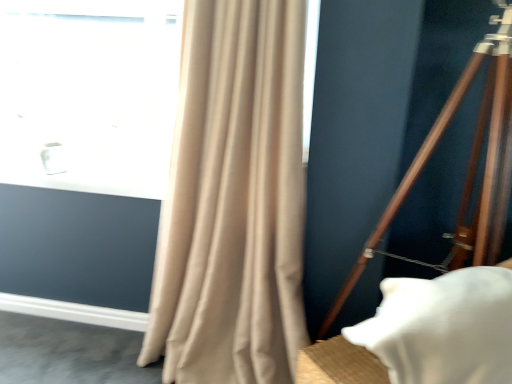
Identify the location of white matte pillow at lower right. This screenshot has height=384, width=512. (443, 327).

Locate an element on the screen. This screenshot has height=384, width=512. beige fabric curtain at left is located at coordinates (233, 200).

Can you confirm if white matte pillow at lower right is thinner than transparent glass window at upper left?

Incorrect, the width of white matte pillow at lower right is not less than that of transparent glass window at upper left.

Locate an element on the screen. This screenshot has width=512, height=384. pillow on the right of transparent glass window at upper left is located at coordinates (443, 327).

Is white matte pillow at lower right oriented away from transparent glass window at upper left?

Yes, white matte pillow at lower right is facing away from transparent glass window at upper left.

Is transparent glass window at upper left inside white matte pillow at lower right?

No, white matte pillow at lower right does not contain transparent glass window at upper left.

Does wooden tripod at right have a larger size compared to transparent glass window at upper left?

Indeed, wooden tripod at right has a larger size compared to transparent glass window at upper left.

Identify the location of tripod below the transparent glass window at upper left (from a real-world perspective). The image size is (512, 384). (467, 168).

Is wooden tripod at right directly adjacent to transparent glass window at upper left?

No.

Is wooden tripod at right at the left side of beige fabric curtain at left?

Incorrect, wooden tripod at right is not on the left side of beige fabric curtain at left.

Who is taller, wooden tripod at right or beige fabric curtain at left?

wooden tripod at right is taller.

Which of these two, wooden tripod at right or beige fabric curtain at left, is wider?

With larger width is wooden tripod at right.

From the picture: From the image's perspective, is beige fabric curtain at left located above wooden tripod at right?

Correct, beige fabric curtain at left appears higher than wooden tripod at right in the image.

Which object is positioned more to the left, beige fabric curtain at left or wooden tripod at right?

beige fabric curtain at left is more to the left.

Find the location of `tripod in front of the beige fabric curtain at left`. tripod in front of the beige fabric curtain at left is located at coordinates (467, 168).

How many degrees apart are the facing directions of beige fabric curtain at left and wooden tripod at right?

The angle between the facing direction of beige fabric curtain at left and the facing direction of wooden tripod at right is 41.7 degrees.

Is beige fabric curtain at left next to transparent glass window at upper left?

No, beige fabric curtain at left is not in contact with transparent glass window at upper left.

Can you tell me how much beige fabric curtain at left and transparent glass window at upper left differ in facing direction?

1.35 degrees.

Who is taller, beige fabric curtain at left or transparent glass window at upper left?

Standing taller between the two is beige fabric curtain at left.

Which object is further away from the camera taking this photo, beige fabric curtain at left or transparent glass window at upper left?

Positioned behind is transparent glass window at upper left.

Find the location of `curtain above the white matte pillow at lower right (from the image's perspective)`. curtain above the white matte pillow at lower right (from the image's perspective) is located at coordinates (233, 200).

Is white matte pillow at lower right oriented away from beige fabric curtain at left?

That's right, white matte pillow at lower right is facing away from beige fabric curtain at left.

Would you say white matte pillow at lower right is outside beige fabric curtain at left?

white matte pillow at lower right lies outside beige fabric curtain at left's area.

From the image's perspective, which is above, white matte pillow at lower right or beige fabric curtain at left?

beige fabric curtain at left.

How different are the orientations of beige fabric curtain at left and white matte pillow at lower right in degrees?

The angle between the facing direction of beige fabric curtain at left and the facing direction of white matte pillow at lower right is 37 degrees.

Is beige fabric curtain at left positioned beyond the bounds of white matte pillow at lower right?

beige fabric curtain at left is positioned outside white matte pillow at lower right.

Is beige fabric curtain at left wider than white matte pillow at lower right?

No, beige fabric curtain at left is not wider than white matte pillow at lower right.

From a real-world perspective, is beige fabric curtain at left under white matte pillow at lower right?

No, from a real-world perspective, beige fabric curtain at left is not below white matte pillow at lower right.

You are a GUI agent. You are given a task and a screenshot of the screen. Output one action in this format:
    pyautogui.click(x=<x>, y=<y>)
    Task: Click on the pillow located underneath the transparent glass window at upper left (from a real-world perspective)
    
    Given the screenshot: What is the action you would take?
    pyautogui.click(x=443, y=327)

The height and width of the screenshot is (384, 512). What are the coordinates of `tripod that is in front of the transparent glass window at upper left` in the screenshot? It's located at (467, 168).

When comparing their distances from transparent glass window at upper left, does beige fabric curtain at left or wooden tripod at right seem closer?

The object closer to transparent glass window at upper left is beige fabric curtain at left.

When comparing their distances from transparent glass window at upper left, does beige fabric curtain at left or white matte pillow at lower right seem further?

white matte pillow at lower right is further to transparent glass window at upper left.

Looking at the image, which one is located closer to beige fabric curtain at left, transparent glass window at upper left or white matte pillow at lower right?

transparent glass window at upper left.

From the image, which object appears to be farther from wooden tripod at right, white matte pillow at lower right or transparent glass window at upper left?

transparent glass window at upper left is positioned further to the anchor wooden tripod at right.

Estimate the real-world distances between objects in this image. Which object is closer to white matte pillow at lower right, beige fabric curtain at left or wooden tripod at right?

wooden tripod at right is positioned closer to the anchor white matte pillow at lower right.

Which object lies further to the anchor point transparent glass window at upper left, white matte pillow at lower right or wooden tripod at right?

white matte pillow at lower right is further to transparent glass window at upper left.

From the image, which object appears to be nearer to transparent glass window at upper left, white matte pillow at lower right or beige fabric curtain at left?

The object closer to transparent glass window at upper left is beige fabric curtain at left.

Based on their spatial positions, is wooden tripod at right or white matte pillow at lower right further from transparent glass window at upper left?

white matte pillow at lower right lies further to transparent glass window at upper left than the other object.

Locate an element on the screen. The image size is (512, 384). pillow situated between beige fabric curtain at left and wooden tripod at right from left to right is located at coordinates (443, 327).

This screenshot has width=512, height=384. What are the coordinates of `curtain located between transparent glass window at upper left and wooden tripod at right in the left-right direction` in the screenshot? It's located at (233, 200).

Identify the location of pillow located between transparent glass window at upper left and wooden tripod at right in the left-right direction. (443, 327).

The height and width of the screenshot is (384, 512). I want to click on curtain between transparent glass window at upper left and white matte pillow at lower right from left to right, so click(233, 200).